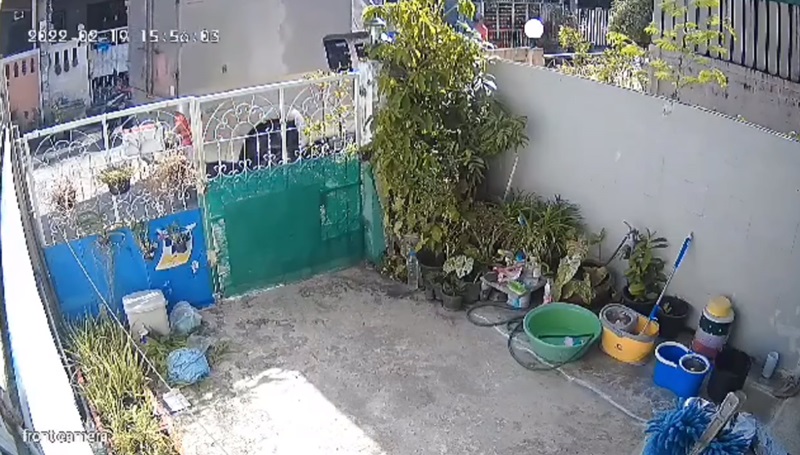
At what (x,y) coordinates should I click in order to perform the action: click on cleaning stick. Please return your answer as a coordinate pair (x, y). Image resolution: width=800 pixels, height=455 pixels. Looking at the image, I should click on (681, 255).